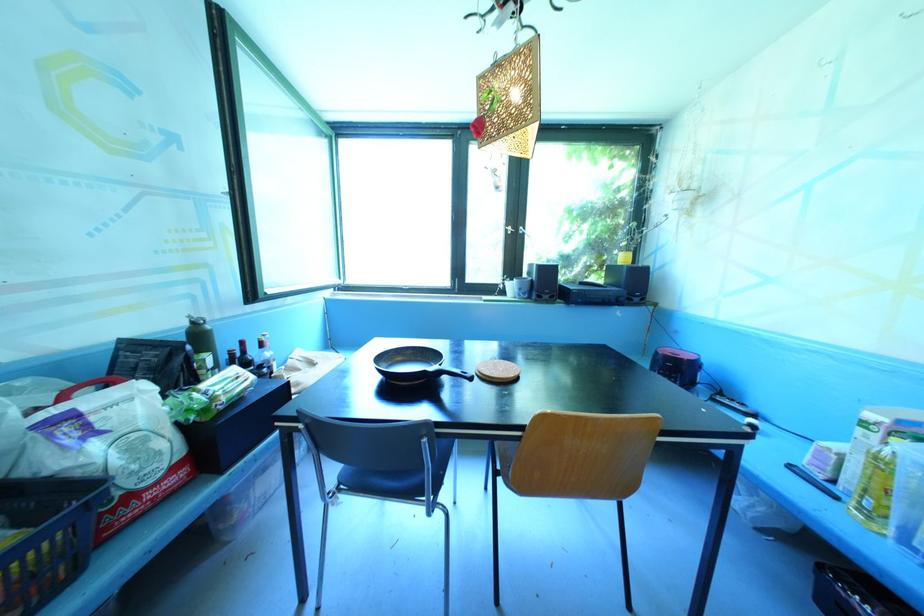
Find where to lift the round cork trivet. Please return your answer as a coordinate pair (x, y).

(497, 371)